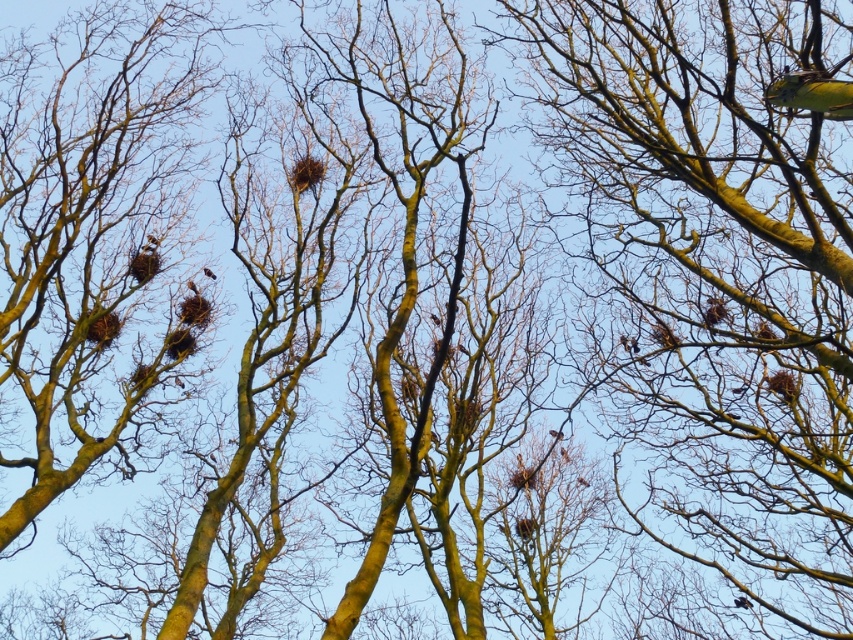
Does smooth bark tree at upper right appear over yellow-green feathers at upper right?

No, smooth bark tree at upper right is not above yellow-green feathers at upper right.

Who is shorter, smooth bark tree at upper right or yellow-green feathers at upper right?

With less height is smooth bark tree at upper right.

Is point (846, 298) closer to camera compared to point (788, 108)?

No, (846, 298) is further to viewer.

I want to click on smooth bark tree at upper right, so click(718, 273).

Who is taller, yellow-green feathers at upper right or brown fuzzy bird at upper center?

Standing taller between the two is yellow-green feathers at upper right.

Which is behind, point (802, 100) or point (207, 268)?

The point (207, 268) is behind.

Locate an element on the screen. This screenshot has width=853, height=640. yellow-green feathers at upper right is located at coordinates (811, 93).

Between smooth bark tree at upper right and brown fuzzy bird at upper center, which one is positioned lower?

smooth bark tree at upper right is lower down.

Can you confirm if smooth bark tree at upper right is shorter than brown fuzzy bird at upper center?

No, smooth bark tree at upper right is not shorter than brown fuzzy bird at upper center.

Who is more forward, (x=744, y=106) or (x=213, y=275)?

Point (x=744, y=106) is in front.

Locate an element on the screen. smooth bark tree at upper right is located at coordinates (718, 273).